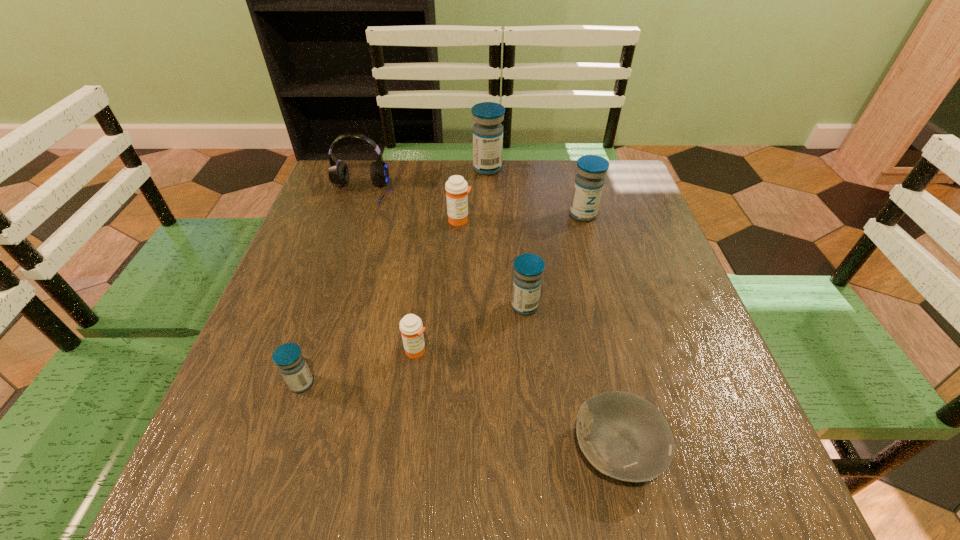
Where is `free spot located 0.060m on the right of the third nearest object`? free spot located 0.060m on the right of the third nearest object is located at coordinates (461, 350).

You are a GUI agent. You are given a task and a screenshot of the screen. Output one action in this format:
    pyautogui.click(x=<x>, y=<y>)
    Task: Click on the free space located on the front of the nearest medicine
    
    Given the screenshot: What is the action you would take?
    pyautogui.click(x=279, y=451)

The image size is (960, 540). In order to click on free region located 0.170m on the left of the gray bowl in this screenshot , I will do `click(465, 448)`.

I want to click on headset that is at the far edge, so click(x=338, y=172).

In order to click on object that is at the near edge in this screenshot , I will do `click(624, 436)`.

Locate an element on the screen. The width and height of the screenshot is (960, 540). headset located in the left edge section of the desktop is located at coordinates (338, 172).

The height and width of the screenshot is (540, 960). In order to click on medicine present at the left edge in this screenshot , I will do `click(288, 357)`.

This screenshot has width=960, height=540. Identify the location of medicine located at the right edge. (589, 182).

Find the location of a particular element. bowl present at the right edge is located at coordinates (624, 436).

In order to click on object located in the far left corner section of the desktop in this screenshot , I will do `click(338, 172)`.